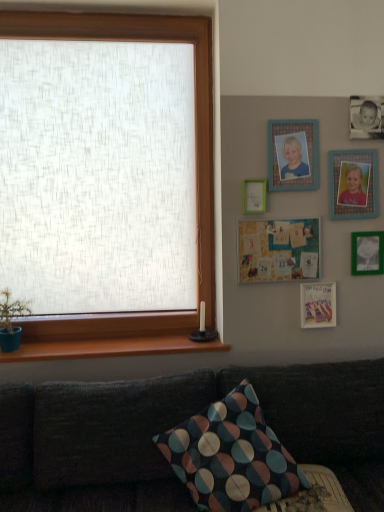
Question: Is wooden bulletin board at upper right, acting as the third picture frame starting from the bottom, to the left or to the right of multicolored fabric pillow at lower center in the image?

Choices:
 (A) right
 (B) left

Answer: (A)

Question: From a real-world perspective, relative to multicolored fabric pillow at lower center, is wooden bulletin board at upper right, acting as the third picture frame starting from the bottom, vertically above or below?

Choices:
 (A) below
 (B) above

Answer: (B)

Question: Considering the real-world distances, which object is closest to the matte paper picture frame at lower right, the sixth picture frame viewed from the top?

Choices:
 (A) wooden at lower left
 (B) wooden photo frame at upper right, the second picture frame in the top-to-bottom sequence
 (C) multicolored fabric pillow at lower center
 (D) green matte picture frame at lower right, which is counted as the 2th picture frame, starting from the bottom
 (E) blue wooden photo frame at upper center, which is the 1th picture frame in top-to-bottom order

Answer: (D)

Question: Which is farther from the wooden bulletin board at upper right, placed as the 4th picture frame when sorted from top to bottom?

Choices:
 (A) green matte picture frame at upper center, which is the 3th picture frame from top to bottom
 (B) matte paper picture frame at lower right, the sixth picture frame viewed from the top
 (C) multicolored fabric pillow at lower center
 (D) dark fabric couch at lower left
 (E) blue wooden photo frame at upper center, arranged as the sixth picture frame when ordered from the bottom

Answer: (C)